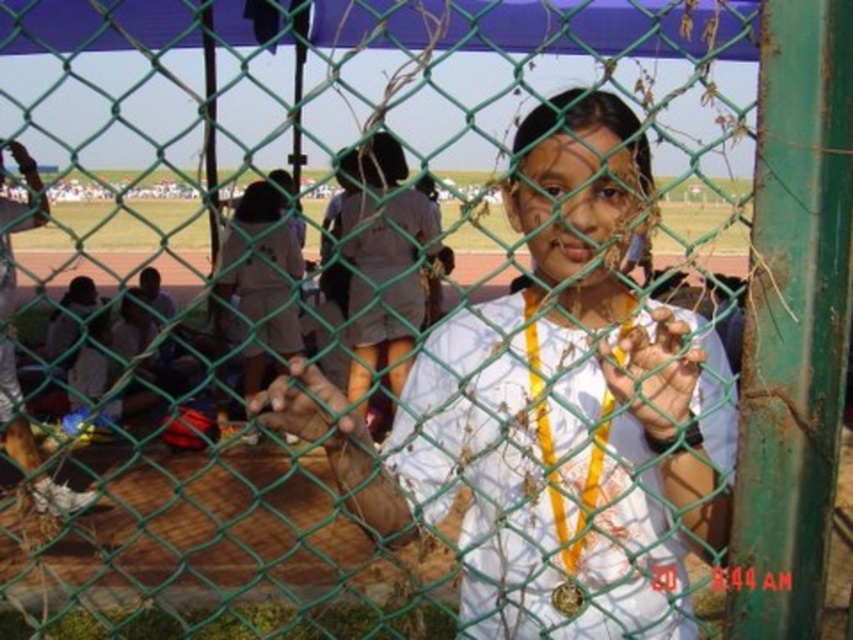
Question: Which point is farther to the camera?

Choices:
 (A) smooth skin hand at center
 (B) smooth brown hand at center

Answer: (B)

Question: Is white matte shirt at center positioned at the back of smooth brown hand at center?

Choices:
 (A) yes
 (B) no

Answer: (B)

Question: Can you confirm if smooth skin hand at center is bigger than smooth brown hand at center?

Choices:
 (A) no
 (B) yes

Answer: (B)

Question: Can you confirm if white matte shirt at center is wider than smooth brown hand at center?

Choices:
 (A) no
 (B) yes

Answer: (B)

Question: Estimate the real-world distances between objects in this image. Which object is farther from the smooth skin hand at center?

Choices:
 (A) white matte shirt at center
 (B) smooth brown hand at center

Answer: (B)

Question: Which point is closer to the camera?

Choices:
 (A) smooth skin hand at center
 (B) white matte shirt at center

Answer: (B)